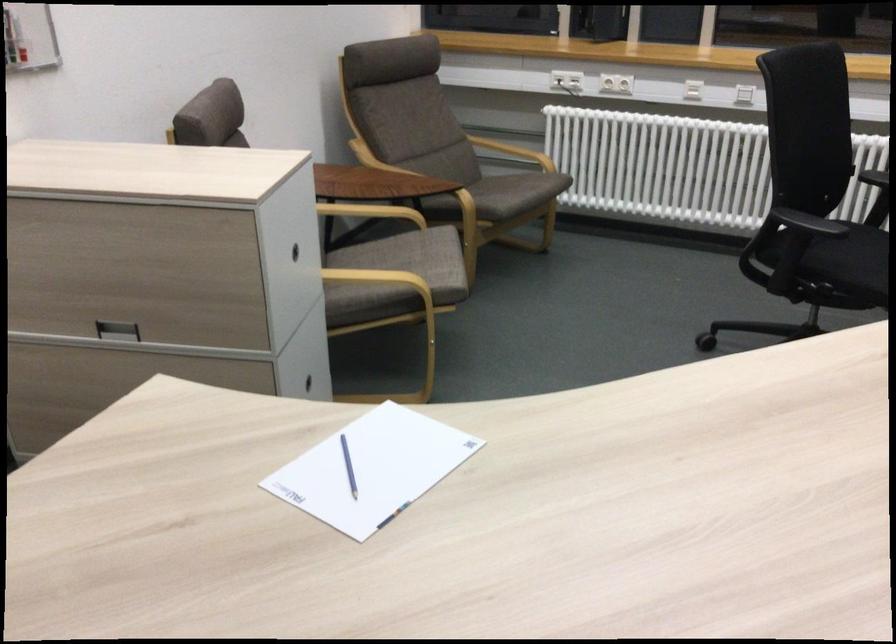
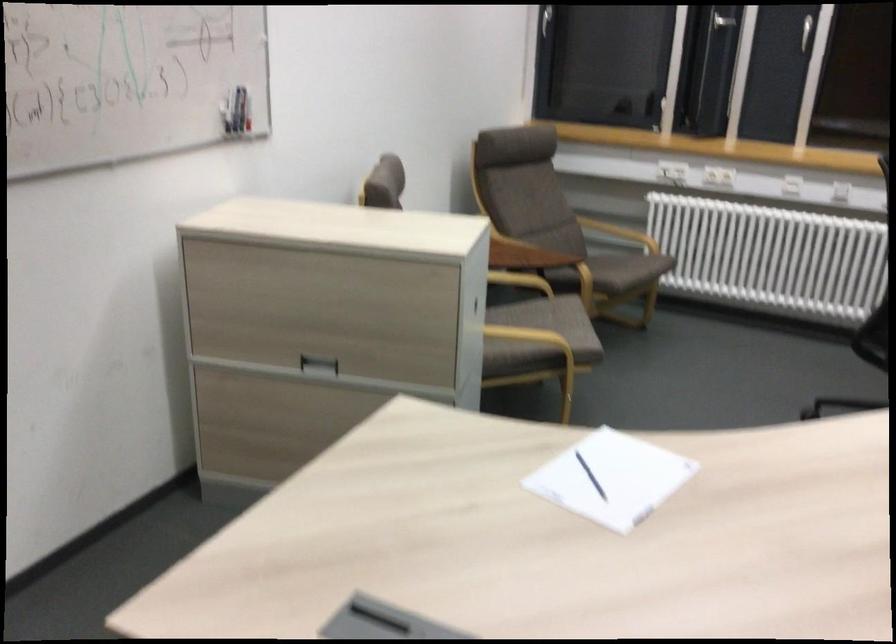
Question: The first image is from the beginning of the video and the second image is from the end. How did the camera likely rotate when shooting the video?

Choices:
 (A) Left
 (B) Right
 (C) Up
 (D) Down

Answer: (C)